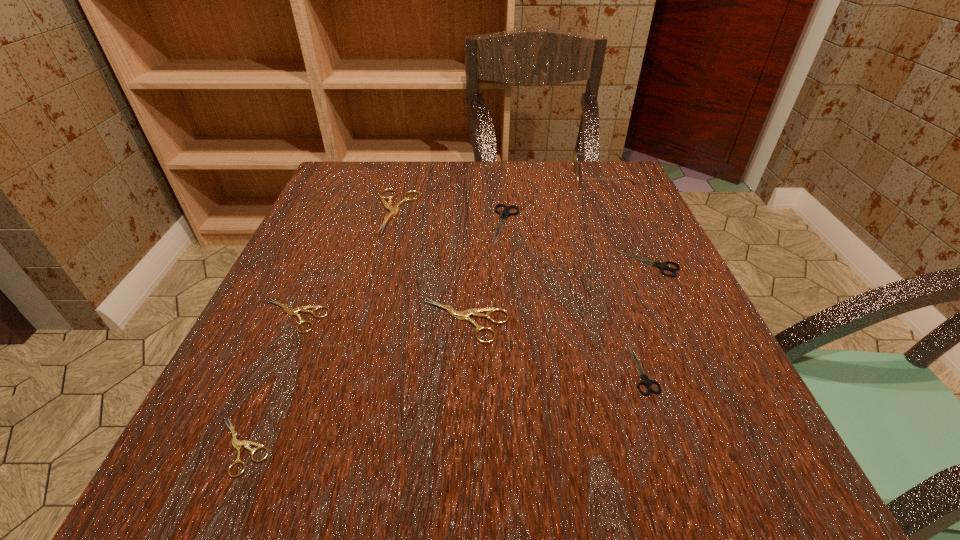
The image size is (960, 540). What are the coordinates of `the second shears from right to left` in the screenshot? It's located at pyautogui.click(x=646, y=381).

The image size is (960, 540). What are the coordinates of `the second black shears from left to right` in the screenshot? It's located at (646, 381).

Find the location of `the nearest beige shears`. the nearest beige shears is located at coordinates (237, 444).

The image size is (960, 540). Identify the location of the nearest object. (237, 444).

Find the location of a particular element. vacant area situated on the front-facing side of the tallest object is located at coordinates (492, 177).

I want to click on free space located on the front-facing side of the tallest object, so click(x=427, y=177).

Locate an element on the screen. free space located on the front-facing side of the tallest object is located at coordinates (440, 177).

This screenshot has height=540, width=960. I want to click on blank space located on the right of the leftmost black shears, so click(652, 225).

The height and width of the screenshot is (540, 960). I want to click on free space located on the right of the farthest beige shears, so click(503, 212).

Locate an element on the screen. This screenshot has width=960, height=540. vacant area located on the back of the third farthest shears is located at coordinates (609, 177).